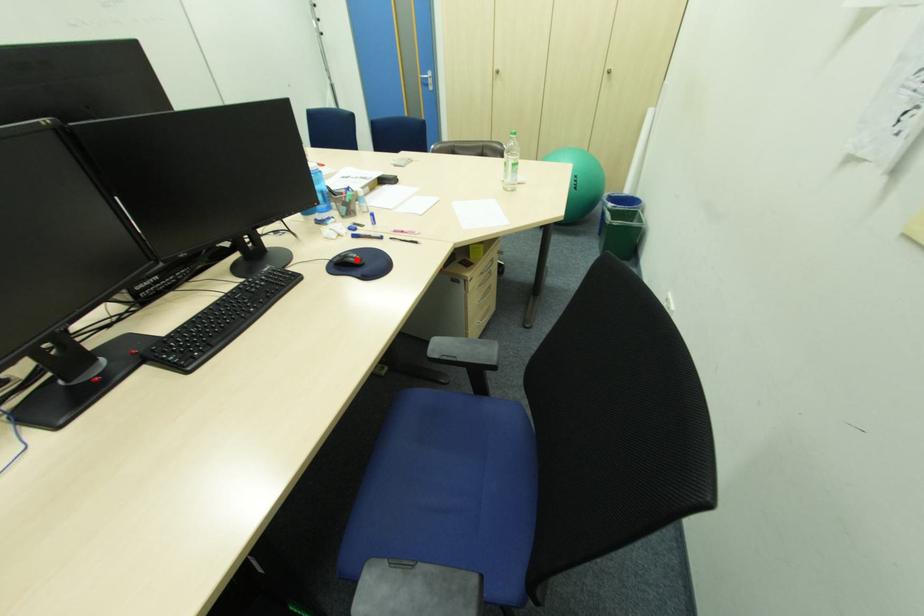
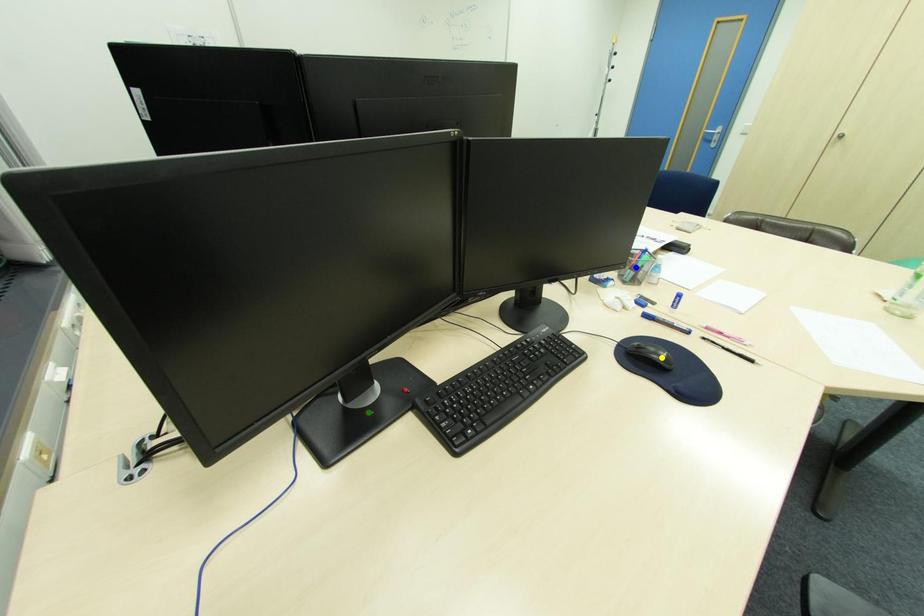
Question: I am providing you with two images of the same scene from different viewpoints. A red point is marked on the first image. You are given multiple points on the second image. Which spot in image 2 lines up with the point in image 1?

Choices:
 (A) blue point
 (B) yellow point
 (C) green point

Answer: (B)